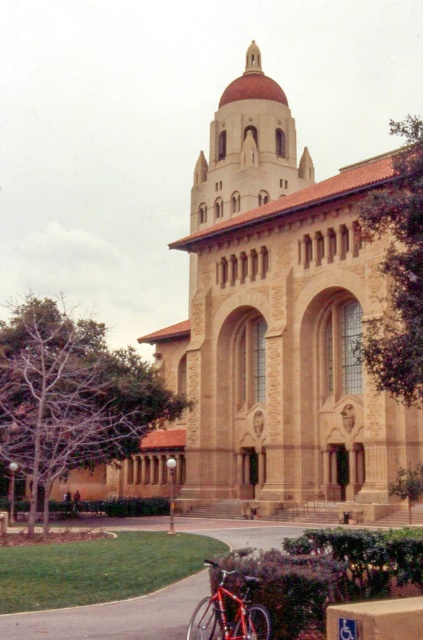
You are standing on the smooth asphalt pavement at lower center and want to enter the beige stone church at center. Which direction should you move to approach the church?

Since the beige stone church at center is closer to you than the smooth asphalt pavement at lower center, you should move forward towards the beige stone church at center to approach it.

You are standing in front of the grand historic building and notice two points marked on the facade. The first point is at coordinate point (x=252, y=525) and the second is at point (x=253, y=604). From your perspective, which point is closer to you?

Point (x=253, y=604) is closer to you because the Objects Description states that point (x=252, y=525) is behind point (x=253, y=604).